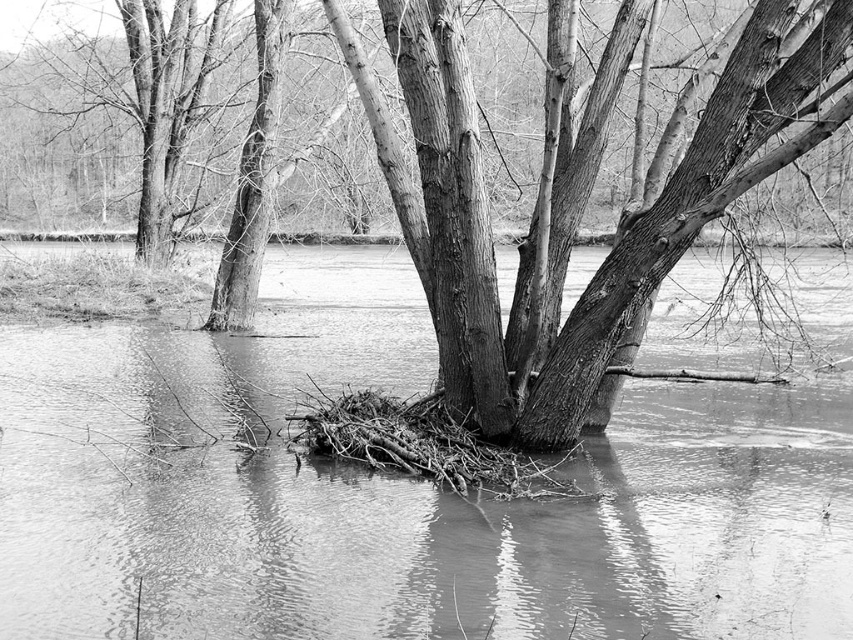
The height and width of the screenshot is (640, 853). Describe the element at coordinates (398, 493) in the screenshot. I see `smooth water at center` at that location.

What do you see at coordinates (398, 493) in the screenshot? Image resolution: width=853 pixels, height=640 pixels. I see `smooth water at center` at bounding box center [398, 493].

Image resolution: width=853 pixels, height=640 pixels. I want to click on smooth water at center, so click(398, 493).